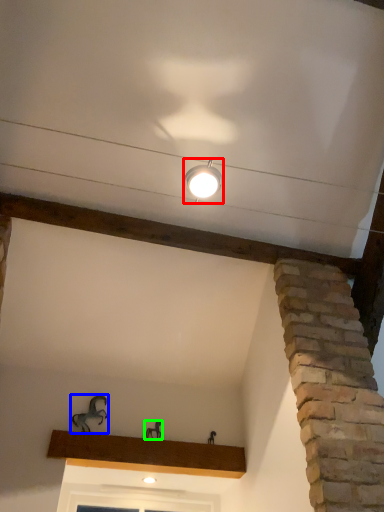
Question: Based on their relative distances, which object is nearer to lamp (highlighted by a red box)? Choose from animal (highlighted by a blue box) and animal (highlighted by a green box).

Choices:
 (A) animal
 (B) animal

Answer: (A)